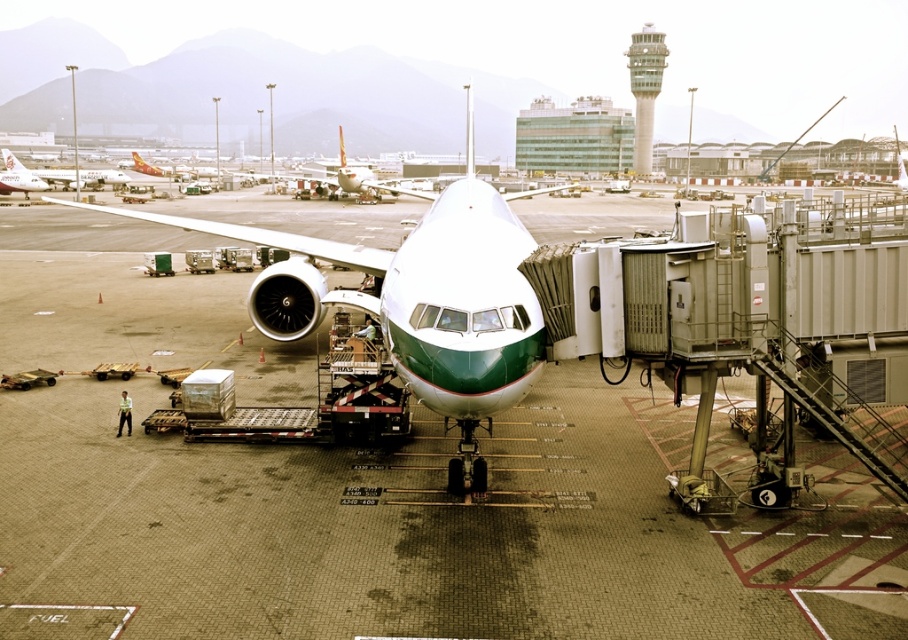
Question: Which point appears farthest from the camera in this image?

Choices:
 (A) (7, 164)
 (B) (413, 280)

Answer: (A)

Question: Does white/green airplane at center appear under green glass control tower at upper center?

Choices:
 (A) no
 (B) yes

Answer: (B)

Question: Does smooth concrete tarmac at center appear on the left side of white/green airplane at center?

Choices:
 (A) yes
 (B) no

Answer: (A)

Question: Does smooth concrete tarmac at center appear under green glass control tower at upper center?

Choices:
 (A) no
 (B) yes

Answer: (B)

Question: Which object is the farthest from the white/green airplane at center?

Choices:
 (A) matte white airplane at left
 (B) smooth concrete tarmac at center
 (C) green glass control tower at upper center

Answer: (C)

Question: Based on their relative distances, which object is nearer to the green glass control tower at upper center?

Choices:
 (A) white/green airplane at center
 (B) matte white airplane at left

Answer: (B)